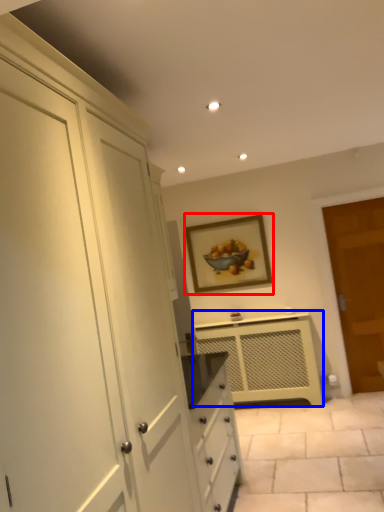
Question: Which object appears closest to the camera in this image, picture frame (highlighted by a red box) or cabinetry (highlighted by a blue box)?

Choices:
 (A) picture frame
 (B) cabinetry

Answer: (B)